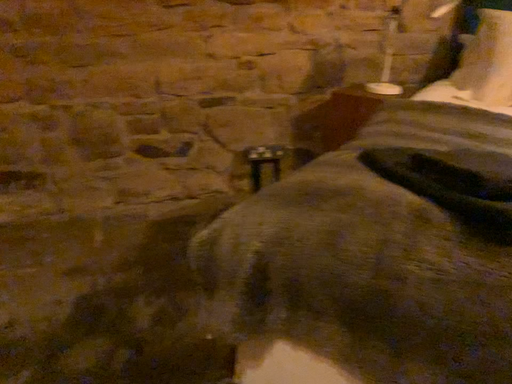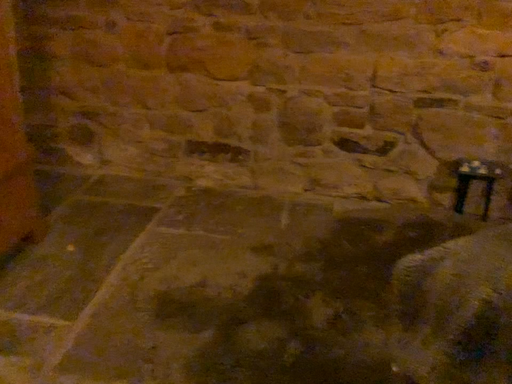
Question: How did the camera likely rotate when shooting the video?

Choices:
 (A) rotated right
 (B) rotated left

Answer: (B)